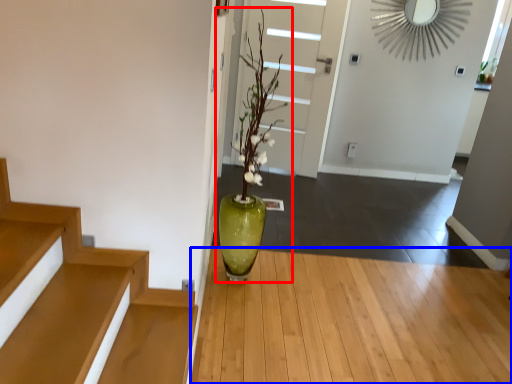
Question: Which point is further to the camera, houseplant (highlighted by a red box) or hardwood (highlighted by a blue box)?

Choices:
 (A) houseplant
 (B) hardwood

Answer: (A)